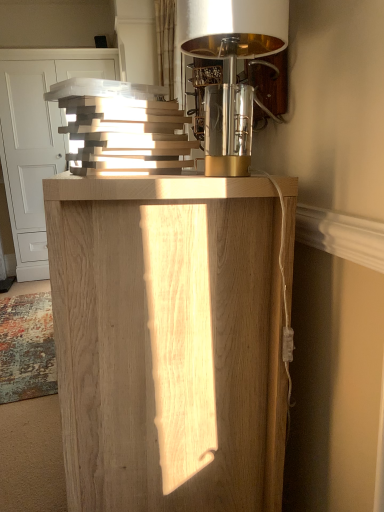
Question: Is polished brass lampshade at upper right oriented away from natural wood cabinet at center?

Choices:
 (A) yes
 (B) no

Answer: (B)

Question: Is polished brass lampshade at upper right shorter than natural wood cabinet at center?

Choices:
 (A) no
 (B) yes

Answer: (B)

Question: From the image's perspective, is polished brass lampshade at upper right on natural wood cabinet at center?

Choices:
 (A) no
 (B) yes

Answer: (B)

Question: Does polished brass lampshade at upper right appear on the right side of natural wood cabinet at center?

Choices:
 (A) yes
 (B) no

Answer: (A)

Question: Is polished brass lampshade at upper right facing towards natural wood cabinet at center?

Choices:
 (A) no
 (B) yes

Answer: (A)

Question: Can you confirm if polished brass lampshade at upper right is positioned to the left of natural wood cabinet at center?

Choices:
 (A) yes
 (B) no

Answer: (B)

Question: Does natural wood cabinet at upper left appear on the right side of natural wood cabinet at center?

Choices:
 (A) yes
 (B) no

Answer: (B)

Question: Considering the relative sizes of natural wood cabinet at upper left and natural wood cabinet at center in the image provided, is natural wood cabinet at upper left wider than natural wood cabinet at center?

Choices:
 (A) yes
 (B) no

Answer: (A)

Question: Is natural wood cabinet at upper left turned away from natural wood cabinet at center?

Choices:
 (A) no
 (B) yes

Answer: (A)

Question: From a real-world perspective, is natural wood cabinet at upper left located beneath natural wood cabinet at center?

Choices:
 (A) yes
 (B) no

Answer: (B)

Question: Can you confirm if natural wood cabinet at upper left is bigger than natural wood cabinet at center?

Choices:
 (A) no
 (B) yes

Answer: (B)

Question: Is natural wood cabinet at center located within natural wood cabinet at upper left?

Choices:
 (A) no
 (B) yes

Answer: (A)

Question: Is the surface of natural wood cabinet at center in direct contact with polished brass lampshade at upper right?

Choices:
 (A) yes
 (B) no

Answer: (B)